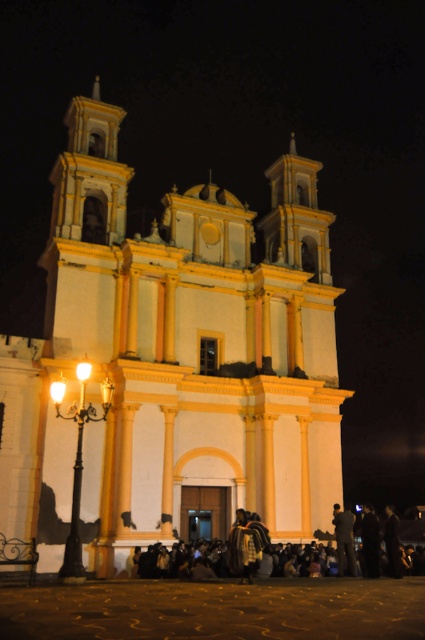
You are standing in front of the church and notice two people in dark clothing at lower center and dark gray fabric jacket at lower center. Which one is positioned to the right side?

The dark clothing at lower center is positioned to the right of the dark gray fabric jacket at lower center.

You are a photographer standing in front of the church at night. You want to take a photo that includes both the dark gray fabric jacket at lower center and the dark fabric coat at lower right. Based on their positions and sizes, which one will appear smaller in the photo?

The dark gray fabric jacket at lower center will appear smaller in the photo because it has a lesser height compared to the dark fabric coat at lower right.